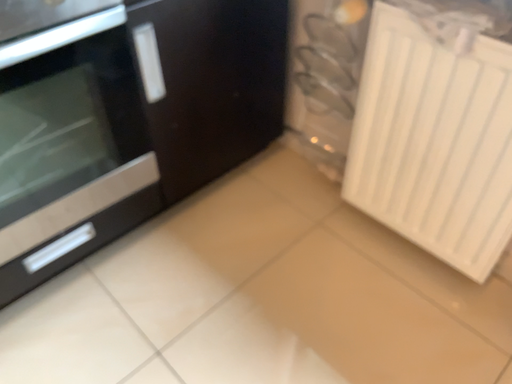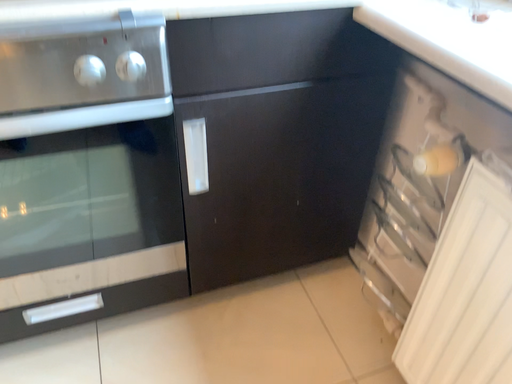
Question: Which way did the camera rotate in the video?

Choices:
 (A) rotated left
 (B) rotated right

Answer: (A)